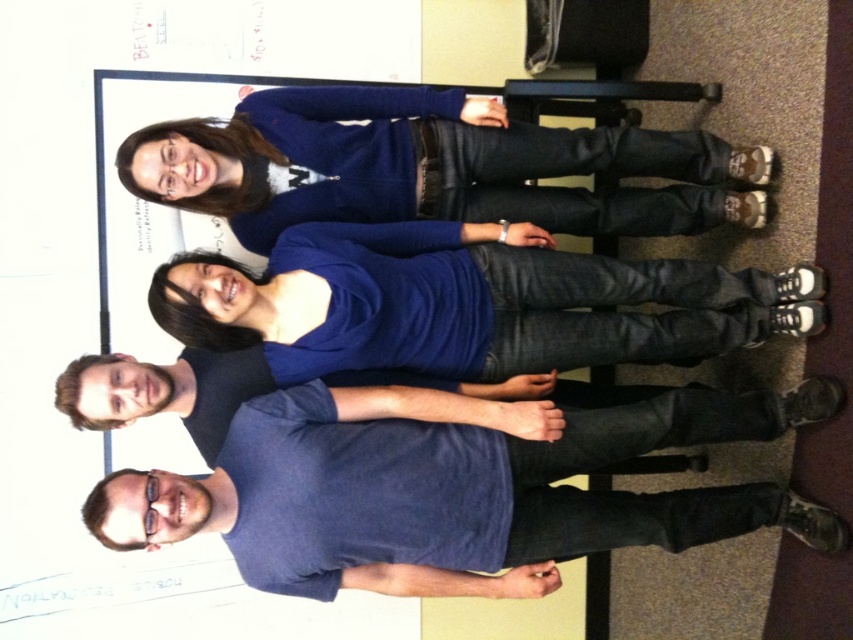
Is blue denim jeans at center above blue cotton t-shirt at center?

Correct, blue denim jeans at center is located above blue cotton t-shirt at center.

How much distance is there between blue denim jeans at center and blue cotton t-shirt at center?

7.50 inches

Is point (746, 310) more distant than point (262, 362)?

Yes, point (746, 310) is behind point (262, 362).

Where is `blue denim jeans at center`? The image size is (853, 640). blue denim jeans at center is located at coordinates pos(463,304).

Which is behind, point (245, 179) or point (178, 385)?

Point (245, 179)

Can you confirm if blue sweater at upper center is wider than blue cotton t-shirt at center?

Yes.

This screenshot has width=853, height=640. What do you see at coordinates (430, 168) in the screenshot?
I see `blue sweater at upper center` at bounding box center [430, 168].

You are a GUI agent. You are given a task and a screenshot of the screen. Output one action in this format:
    pyautogui.click(x=<x>, y=<y>)
    Task: Click on the blue sweater at upper center
    
    Given the screenshot: What is the action you would take?
    pyautogui.click(x=430, y=168)

Is point (616, 452) farther from viewer compared to point (431, 211)?

No, it is not.

Is point (347, 394) in front of point (436, 93)?

Yes.

Locate an element on the screen. This screenshot has height=640, width=853. blue cotton t-shirt at lower center is located at coordinates (448, 488).